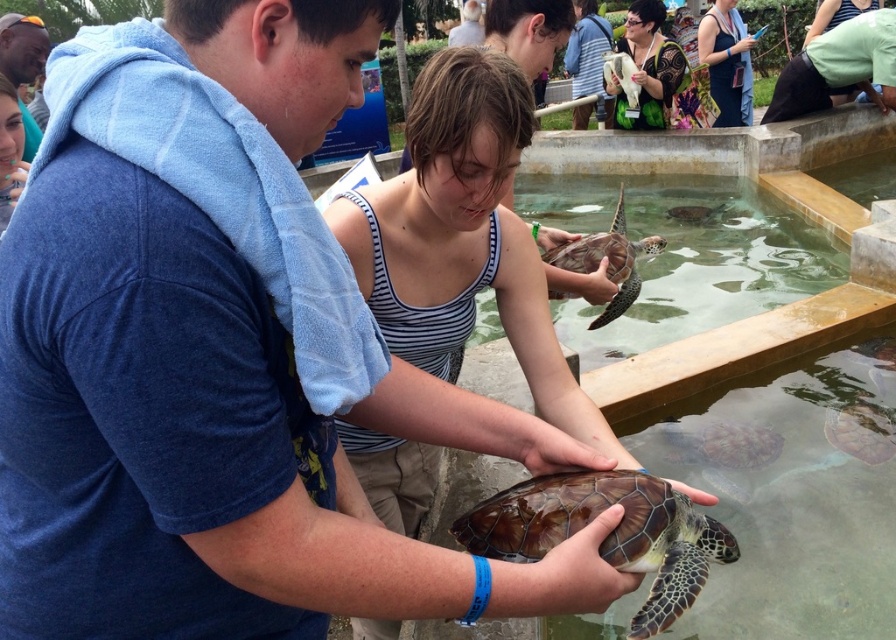
Question: Can you confirm if matte black dress at upper center is positioned below matte black turtle at upper center?

Choices:
 (A) no
 (B) yes

Answer: (B)

Question: Is matte black dress at upper center smaller than green fabric pants at lower right?

Choices:
 (A) yes
 (B) no

Answer: (A)

Question: Based on their relative distances, which object is farther from the patterned fabric dress at upper center?

Choices:
 (A) matte black turtle at upper center
 (B) striped tank top at center
 (C) matte black dress at upper center

Answer: (B)

Question: Which object is closer to the camera taking this photo?

Choices:
 (A) matte black turtle at upper center
 (B) matte black dress at upper center
 (C) smooth skin face at upper left
 (D) striped tank top at center

Answer: (D)

Question: Which object is closer to the camera taking this photo?

Choices:
 (A) matte black turtle at upper center
 (B) matte black dress at upper center
 (C) shiny brown shell at center
 (D) patterned fabric dress at upper center

Answer: (C)

Question: Does patterned fabric dress at upper center appear over matte black turtle at upper center?

Choices:
 (A) no
 (B) yes

Answer: (A)